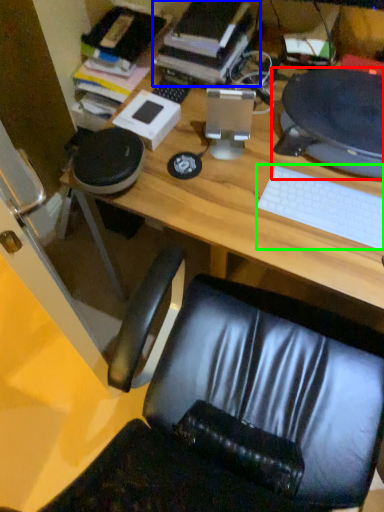
Question: Estimate the real-world distances between objects in this image. Which object is farther from desktop computer (highlighted by a red box), book (highlighted by a blue box) or keyboard (highlighted by a green box)?

Choices:
 (A) book
 (B) keyboard

Answer: (A)